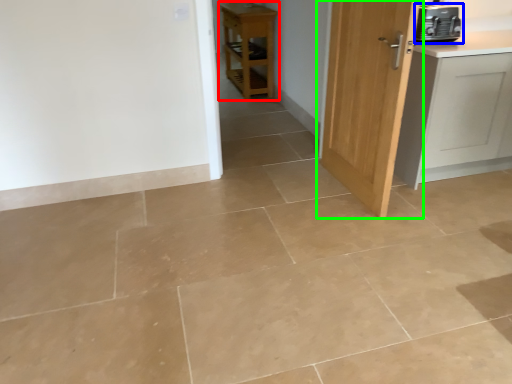
Question: Based on their relative distances, which object is farther from furniture (highlighted by a red box)? Choose from home appliance (highlighted by a blue box) and door (highlighted by a green box).

Choices:
 (A) home appliance
 (B) door

Answer: (A)